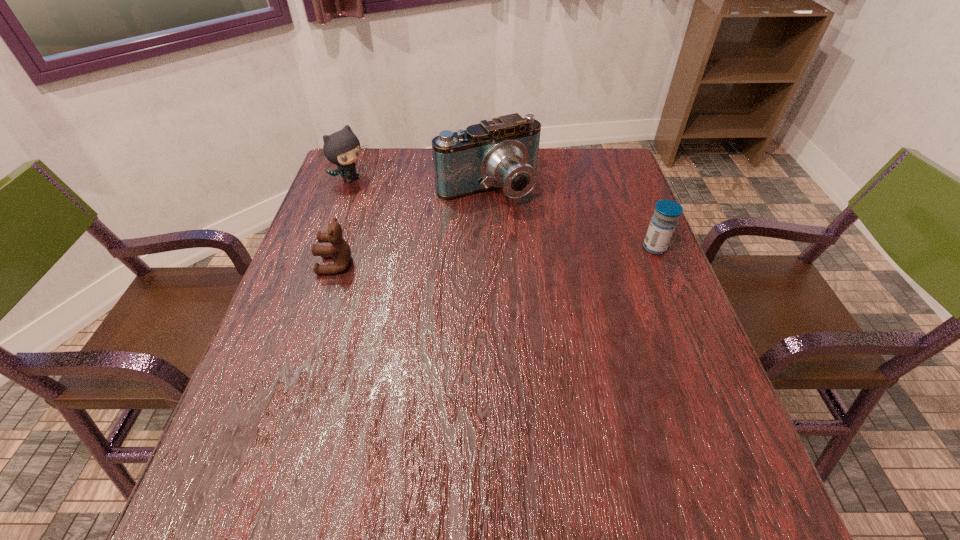
Where is `teddy bear`? The image size is (960, 540). teddy bear is located at coordinates (340, 251).

Locate an element on the screen. The image size is (960, 540). the rightmost object is located at coordinates (667, 212).

The width and height of the screenshot is (960, 540). I want to click on the second object from right to left, so click(x=502, y=153).

You are a GUI agent. You are given a task and a screenshot of the screen. Output one action in this format:
    pyautogui.click(x=<x>, y=<y>)
    Task: Click on the camcorder
    This screenshot has width=960, height=540.
    Given the screenshot: What is the action you would take?
    pyautogui.click(x=502, y=153)

You are a GUI agent. You are given a task and a screenshot of the screen. Output one action in this format:
    pyautogui.click(x=<x>, y=<y>)
    Task: Click on the third shortest object
    
    Given the screenshot: What is the action you would take?
    pyautogui.click(x=342, y=148)

Locate an element on the screen. free location located on the face of the teddy bear is located at coordinates (300, 265).

Find the location of a particular element. This screenshot has height=540, width=960. vacant space located on the front of the rightmost object is located at coordinates (701, 362).

Locate an element on the screen. vacant space located on the front-facing side of the tallest object is located at coordinates (554, 268).

You are a GUI agent. You are given a task and a screenshot of the screen. Output one action in this format:
    pyautogui.click(x=<x>, y=<y>)
    Task: Click on the free space located 0.240m on the front-facing side of the tallest object
    
    Given the screenshot: What is the action you would take?
    pyautogui.click(x=551, y=265)

This screenshot has width=960, height=540. In order to click on free space located 0.050m on the front-facing side of the tallest object in this screenshot , I will do `click(516, 220)`.